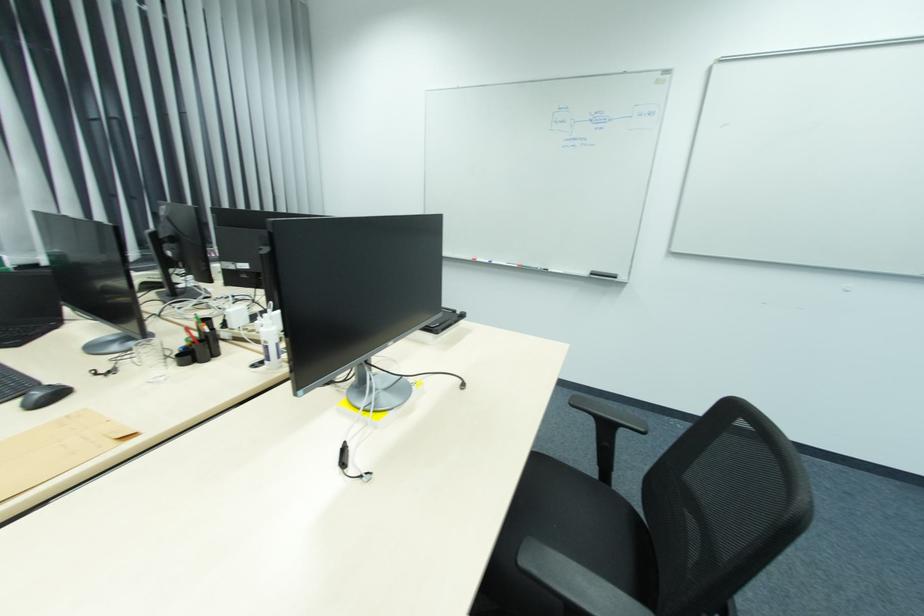
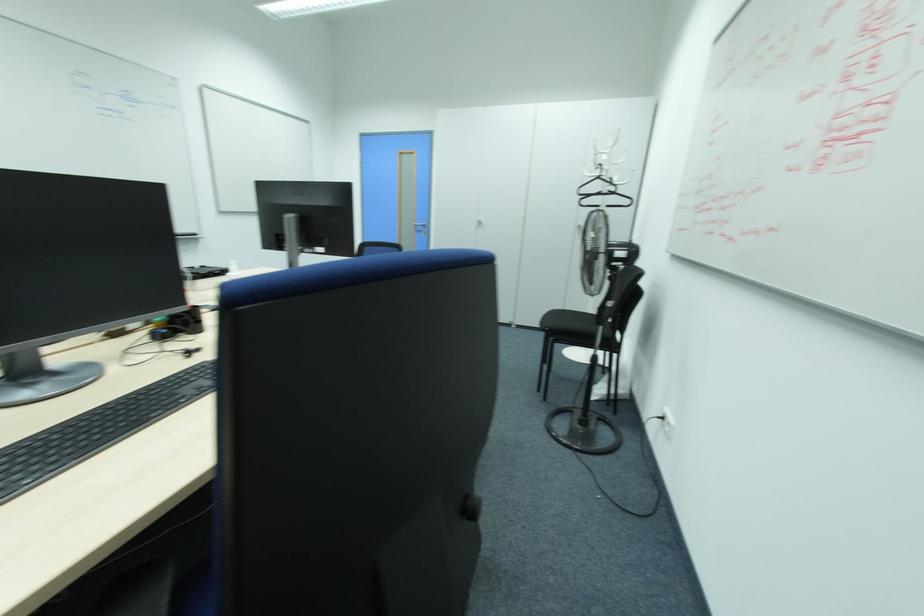
Question: I am providing you with two images of the same scene from different viewpoints. Please identify which objects are invisible in image2.

Choices:
 (A) grey stuffed toy
 (B) black adjustment knob
 (C) glass cup
 (D) white power outlet

Answer: (C)